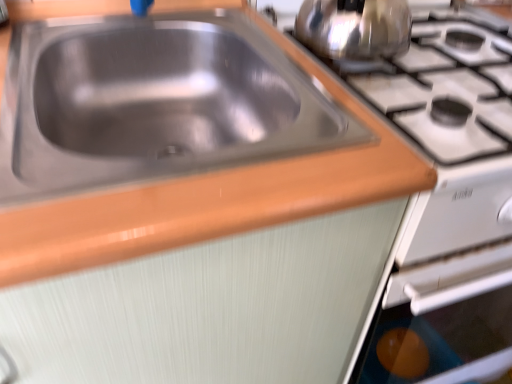
What do you see at coordinates (355, 28) in the screenshot?
I see `shiny metallic kettle at upper right` at bounding box center [355, 28].

What is the approximate height of shiny metallic kettle at upper right?

8.50 inches.

Where is `shiny metallic kettle at upper right`? Image resolution: width=512 pixels, height=384 pixels. shiny metallic kettle at upper right is located at coordinates (355, 28).

What do you see at coordinates (152, 103) in the screenshot? I see `stainless steel sink at upper left` at bounding box center [152, 103].

This screenshot has height=384, width=512. Find the location of `stainless steel sink at upper left`. stainless steel sink at upper left is located at coordinates tap(152, 103).

Find the location of `shiny metallic kettle at upper right`. shiny metallic kettle at upper right is located at coordinates (355, 28).

Would you say shiny metallic kettle at upper right is to the left or to the right of stainless steel sink at upper left in the picture?

In the image, shiny metallic kettle at upper right appears on the right side of stainless steel sink at upper left.

Which is behind, shiny metallic kettle at upper right or stainless steel sink at upper left?

shiny metallic kettle at upper right is further away from the camera.

Does point (408, 9) come farther from viewer compared to point (103, 22)?

Yes, point (408, 9) is farther from viewer.

From the image's perspective, does shiny metallic kettle at upper right appear higher than stainless steel sink at upper left?

Correct, shiny metallic kettle at upper right appears higher than stainless steel sink at upper left in the image.

From a real-world perspective, does shiny metallic kettle at upper right sit lower than stainless steel sink at upper left?

No, from a real-world perspective, shiny metallic kettle at upper right is not under stainless steel sink at upper left.

Can you confirm if shiny metallic kettle at upper right is wider than stainless steel sink at upper left?

Incorrect, the width of shiny metallic kettle at upper right does not surpass that of stainless steel sink at upper left.

Considering the sizes of shiny metallic kettle at upper right and stainless steel sink at upper left in the image, is shiny metallic kettle at upper right taller or shorter than stainless steel sink at upper left?

Clearly, shiny metallic kettle at upper right is taller compared to stainless steel sink at upper left.

Considering the sizes of objects shiny metallic kettle at upper right and stainless steel sink at upper left in the image provided, who is bigger, shiny metallic kettle at upper right or stainless steel sink at upper left?

stainless steel sink at upper left is bigger.

Is stainless steel sink at upper left located within shiny metallic kettle at upper right?

Actually, stainless steel sink at upper left is outside shiny metallic kettle at upper right.

Is shiny metallic kettle at upper right next to stainless steel sink at upper left?

No, shiny metallic kettle at upper right is not next to stainless steel sink at upper left.

Is shiny metallic kettle at upper right facing towards stainless steel sink at upper left?

No, shiny metallic kettle at upper right is not turned towards stainless steel sink at upper left.

Measure the distance from shiny metallic kettle at upper right to stainless steel sink at upper left.

shiny metallic kettle at upper right and stainless steel sink at upper left are 10.16 inches apart.

Where is `sink in front of the shiny metallic kettle at upper right`? This screenshot has height=384, width=512. sink in front of the shiny metallic kettle at upper right is located at coordinates (152, 103).

Considering the relative positions of stainless steel sink at upper left and shiny metallic kettle at upper right in the image provided, is stainless steel sink at upper left to the right of shiny metallic kettle at upper right from the viewer's perspective?

No.

From the picture: Considering the relative positions of stainless steel sink at upper left and shiny metallic kettle at upper right in the image provided, is stainless steel sink at upper left behind shiny metallic kettle at upper right?

No, stainless steel sink at upper left is closer to the camera.

Looking at this image, which is less distant, [201,148] or [368,26]?

Clearly, point [201,148] is more distant from the camera than point [368,26].

From the image's perspective, which object appears higher, stainless steel sink at upper left or shiny metallic kettle at upper right?

shiny metallic kettle at upper right, from the image's perspective.

From a real-world perspective, between stainless steel sink at upper left and shiny metallic kettle at upper right, who is vertically higher?

From a 3D spatial view, shiny metallic kettle at upper right is above.

In the scene shown: Which of these two, stainless steel sink at upper left or shiny metallic kettle at upper right, is thinner?

With smaller width is shiny metallic kettle at upper right.

In terms of height, does stainless steel sink at upper left look taller or shorter compared to shiny metallic kettle at upper right?

Clearly, stainless steel sink at upper left is shorter compared to shiny metallic kettle at upper right.

In terms of size, does stainless steel sink at upper left appear bigger or smaller than shiny metallic kettle at upper right?

Clearly, stainless steel sink at upper left is larger in size than shiny metallic kettle at upper right.

Does stainless steel sink at upper left contain shiny metallic kettle at upper right?

No.

Are stainless steel sink at upper left and shiny metallic kettle at upper right beside each other?

No, stainless steel sink at upper left is not with shiny metallic kettle at upper right.

Is stainless steel sink at upper left oriented away from shiny metallic kettle at upper right?

No, stainless steel sink at upper left is not facing away from shiny metallic kettle at upper right.

How different are the orientations of stainless steel sink at upper left and shiny metallic kettle at upper right in degrees?

stainless steel sink at upper left and shiny metallic kettle at upper right are facing 1.34 degrees away from each other.

Find the location of a particular element. This screenshot has height=384, width=512. tea pot located above the stainless steel sink at upper left (from a real-world perspective) is located at coordinates (355, 28).

Identify the location of sink that appears below the shiny metallic kettle at upper right (from a real-world perspective). (152, 103).

This screenshot has height=384, width=512. Find the location of `tea pot behind the stainless steel sink at upper left`. tea pot behind the stainless steel sink at upper left is located at coordinates (355, 28).